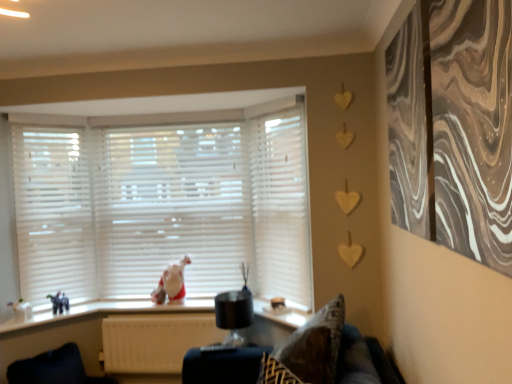
Question: From a real-world perspective, relative to white matte radiator at lower center, is white glossy vase at lower left vertically above or below?

Choices:
 (A) below
 (B) above

Answer: (B)

Question: Based on their positions, is white glossy vase at lower left located to the left or right of white matte radiator at lower center?

Choices:
 (A) right
 (B) left

Answer: (B)

Question: Which of these objects is positioned closest to the white plastic window sill at lower center?

Choices:
 (A) white glossy chicken at center
 (B) white glossy vase at lower left
 (C) white matte blinds at center, the second curtain viewed from the front
 (D) white matte blinds at left
 (E) velvet dark blue swivel chair at lower left

Answer: (A)

Question: Which object is positioned closest to the velvet dark blue swivel chair at lower left?

Choices:
 (A) patterned fabric pillow at lower center
 (B) marble-patterned artwork at upper right, placed as the 2th curtain when sorted from left to right
 (C) white matte blinds at left
 (D) white plastic window sill at lower center
 (E) white glossy vase at lower left

Answer: (D)